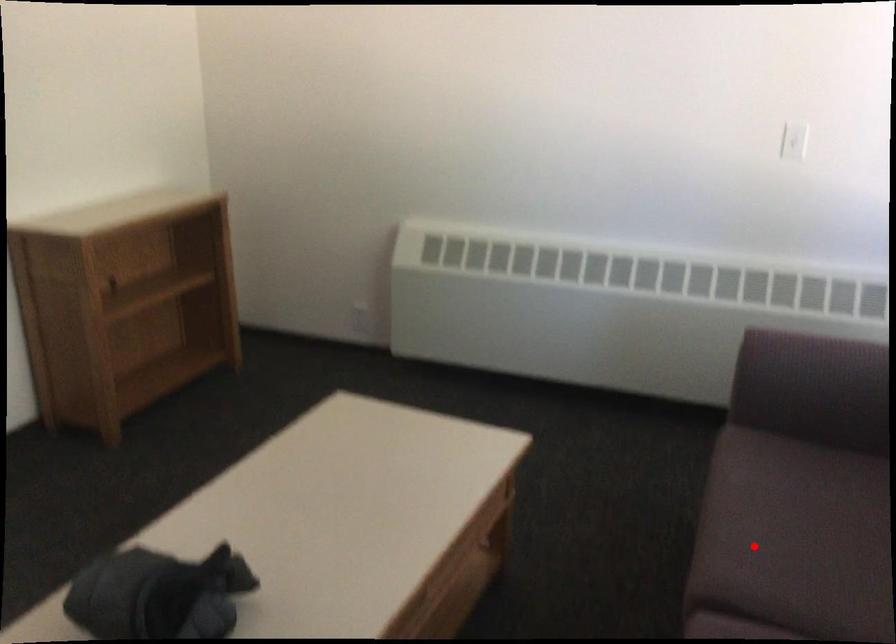
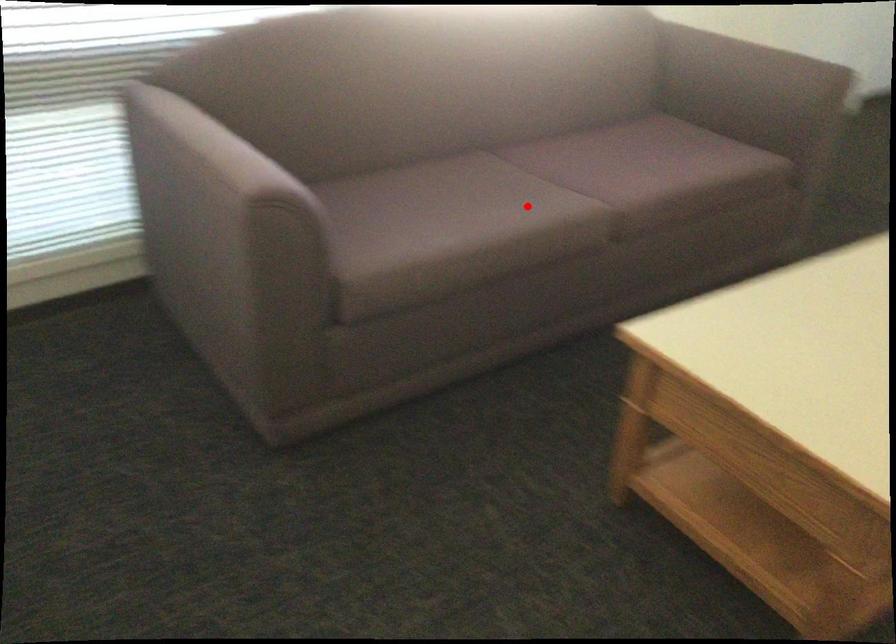
I am providing you with two images of the same scene from different viewpoints. A red point is marked on the first image and another point is marked on the second image. Does the point marked in image1 correspond to the same location as the one in image2?

Yes